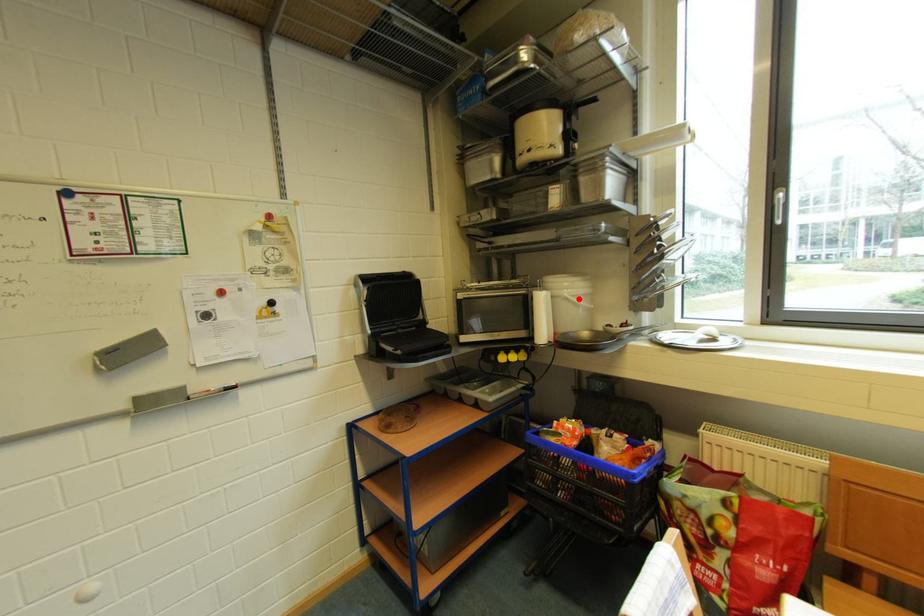
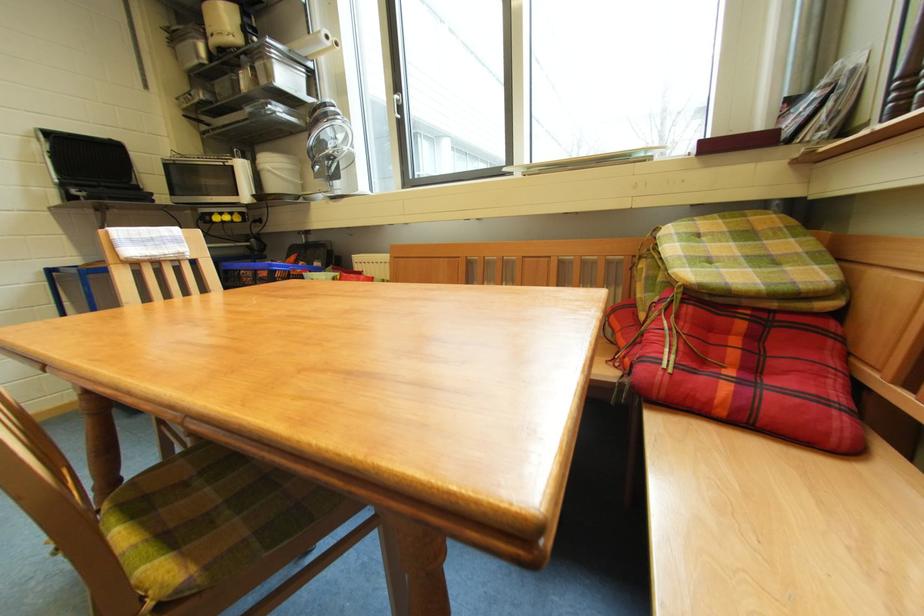
Locate, in the second image, the point that corresponds to the highlighted location in the first image.

(281, 171)